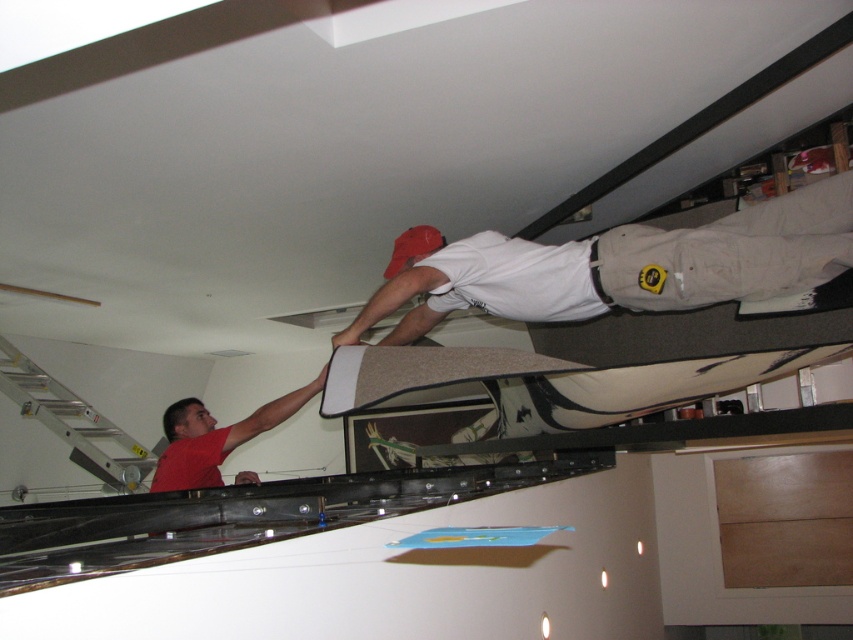
Question: Is white matte shirt at upper center behind red matte shirt at lower left?

Choices:
 (A) yes
 (B) no

Answer: (A)

Question: Which of the following is the farthest from the observer?

Choices:
 (A) (117, 470)
 (B) (167, 472)

Answer: (A)

Question: From the image, what is the correct spatial relationship of silver/aluminum ladder at lower left in relation to red matte shirt at lower left?

Choices:
 (A) below
 (B) above

Answer: (A)

Question: Which object appears closest to the camera in this image?

Choices:
 (A) silver/aluminum ladder at lower left
 (B) white matte shirt at upper center

Answer: (B)

Question: Which object is positioned farthest from the white matte shirt at upper center?

Choices:
 (A) silver/aluminum ladder at lower left
 (B) red matte shirt at lower left

Answer: (A)

Question: From the image, what is the correct spatial relationship of white matte shirt at upper center in relation to red matte shirt at lower left?

Choices:
 (A) left
 (B) right

Answer: (B)